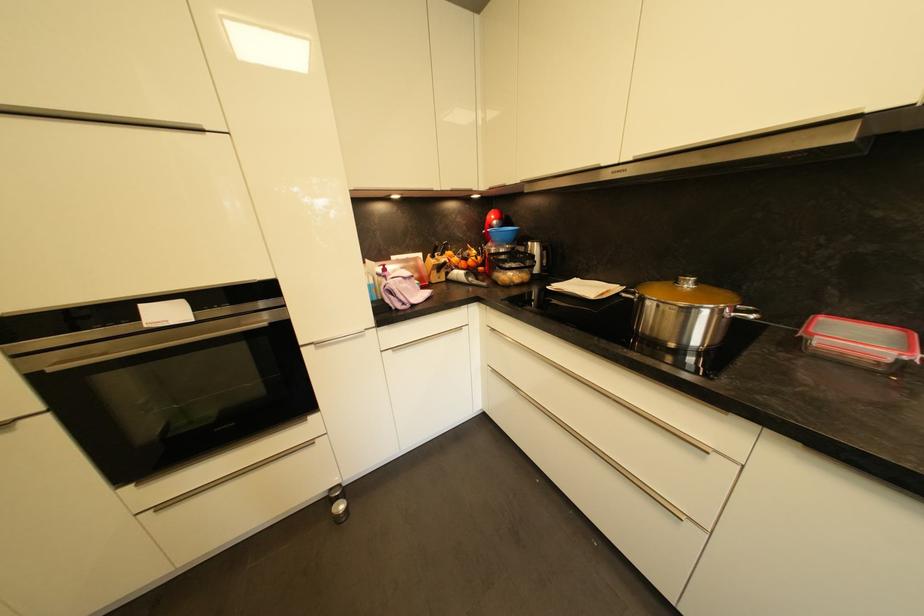
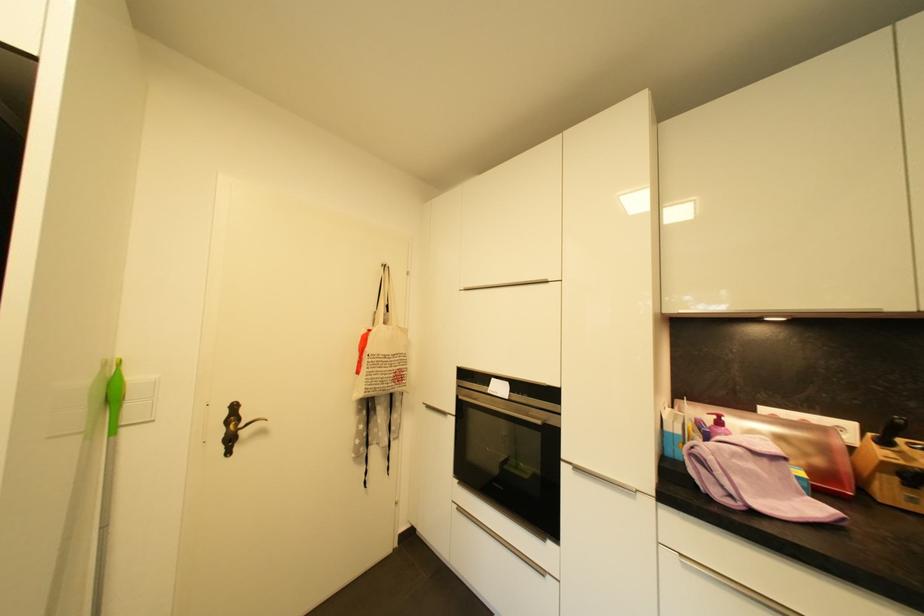
Where in the second image is the point corresponding to point (390, 272) from the first image?

(724, 424)